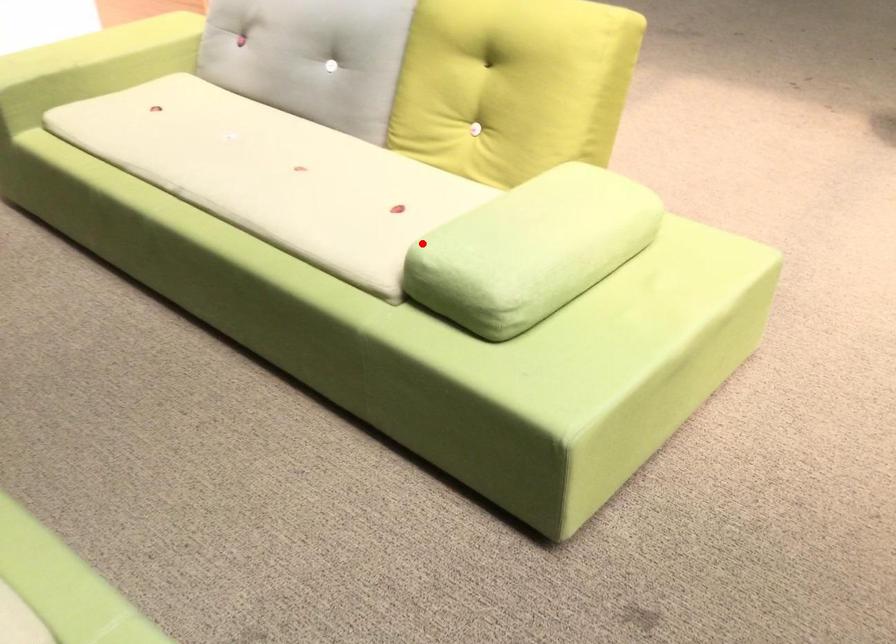
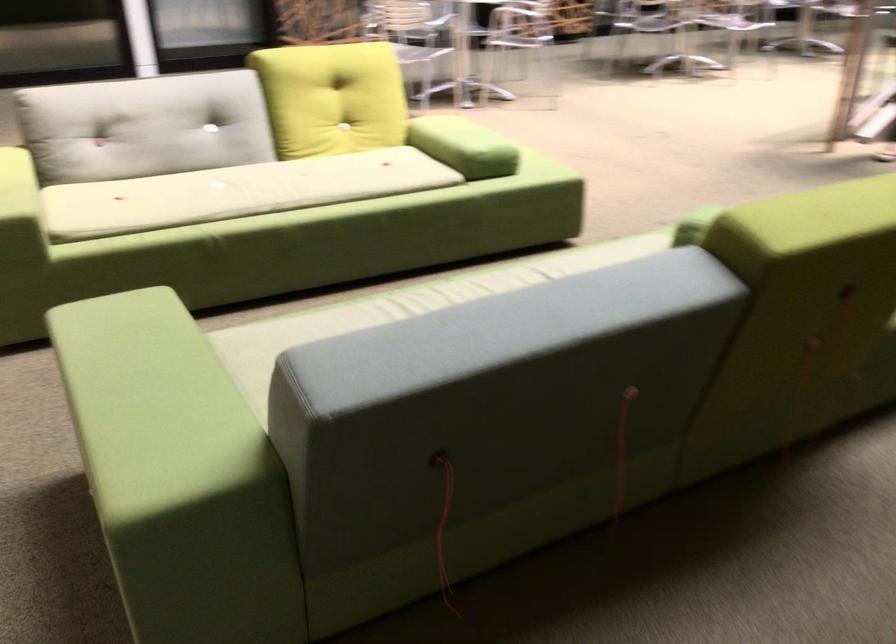
The point at the highlighted location is marked in the first image. Where is the corresponding point in the second image?

(464, 146)